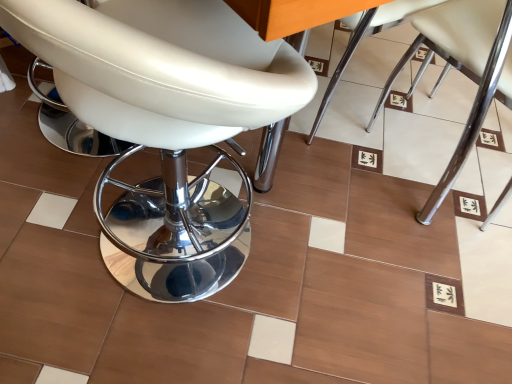
Question: Is there a large distance between white leather chair at center, acting as the 2th chair starting from the right, and white leather chair at center, positioned as the 3th chair in left-to-right order?

Choices:
 (A) yes
 (B) no

Answer: (B)

Question: From a real-world perspective, is white leather chair at center, which ranks as the second chair in left-to-right order, under white leather chair at center, the 1th chair viewed from the right?

Choices:
 (A) yes
 (B) no

Answer: (A)

Question: Is white leather chair at center, acting as the 2th chair starting from the right, positioned beyond the bounds of white leather chair at center, positioned as the 3th chair in left-to-right order?

Choices:
 (A) no
 (B) yes

Answer: (B)

Question: Can you confirm if white leather chair at center, acting as the 2th chair starting from the right, is taller than white leather chair at center, the 1th chair viewed from the right?

Choices:
 (A) no
 (B) yes

Answer: (A)

Question: Does white leather chair at center, which ranks as the second chair in left-to-right order, have a larger size compared to white leather chair at center, positioned as the 3th chair in left-to-right order?

Choices:
 (A) no
 (B) yes

Answer: (A)

Question: Based on their positions, is white leather stool at left, which appears as the first chair when viewed from the left, located to the left or right of white leather chair at center, acting as the 2th chair starting from the right?

Choices:
 (A) left
 (B) right

Answer: (A)

Question: From a real-world perspective, is white leather stool at left, which appears as the third chair when viewed from the right, physically located above or below white leather chair at center, acting as the 2th chair starting from the right?

Choices:
 (A) above
 (B) below

Answer: (A)

Question: From the image's perspective, is white leather stool at left, which appears as the first chair when viewed from the left, above or below white leather chair at center, which ranks as the second chair in left-to-right order?

Choices:
 (A) below
 (B) above

Answer: (A)

Question: Is point (218, 13) closer or farther from the camera than point (331, 86)?

Choices:
 (A) closer
 (B) farther

Answer: (A)

Question: From the image's perspective, is white leather chair at center, the 1th chair viewed from the right, positioned above or below white leather stool at left, which appears as the third chair when viewed from the right?

Choices:
 (A) above
 (B) below

Answer: (A)

Question: Is white leather chair at center, positioned as the 3th chair in left-to-right order, inside or outside of white leather stool at left, which appears as the first chair when viewed from the left?

Choices:
 (A) inside
 (B) outside

Answer: (B)

Question: Considering their positions, is white leather chair at center, the 1th chair viewed from the right, located in front of or behind white leather stool at left, which appears as the third chair when viewed from the right?

Choices:
 (A) front
 (B) behind

Answer: (B)

Question: In terms of height, does white leather chair at center, positioned as the 3th chair in left-to-right order, look taller or shorter compared to white leather stool at left, which appears as the first chair when viewed from the left?

Choices:
 (A) short
 (B) tall

Answer: (A)

Question: Looking at their shapes, would you say white leather chair at center, acting as the 2th chair starting from the right, is wider or thinner than white leather stool at left, which appears as the first chair when viewed from the left?

Choices:
 (A) thin
 (B) wide

Answer: (A)

Question: In terms of height, does white leather chair at center, acting as the 2th chair starting from the right, look taller or shorter compared to white leather stool at left, which appears as the first chair when viewed from the left?

Choices:
 (A) tall
 (B) short

Answer: (B)